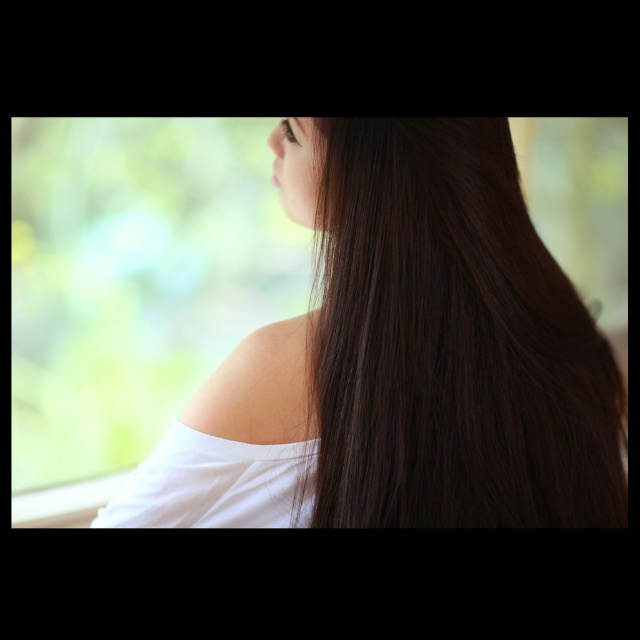
Between dark brown silky hair at center and white smooth shoulder at center, which one is positioned higher?

dark brown silky hair at center

Is point (394, 269) less distant than point (307, 417)?

Yes, point (394, 269) is closer to viewer.

The height and width of the screenshot is (640, 640). In order to click on dark brown silky hair at center in this screenshot , I will do `click(451, 340)`.